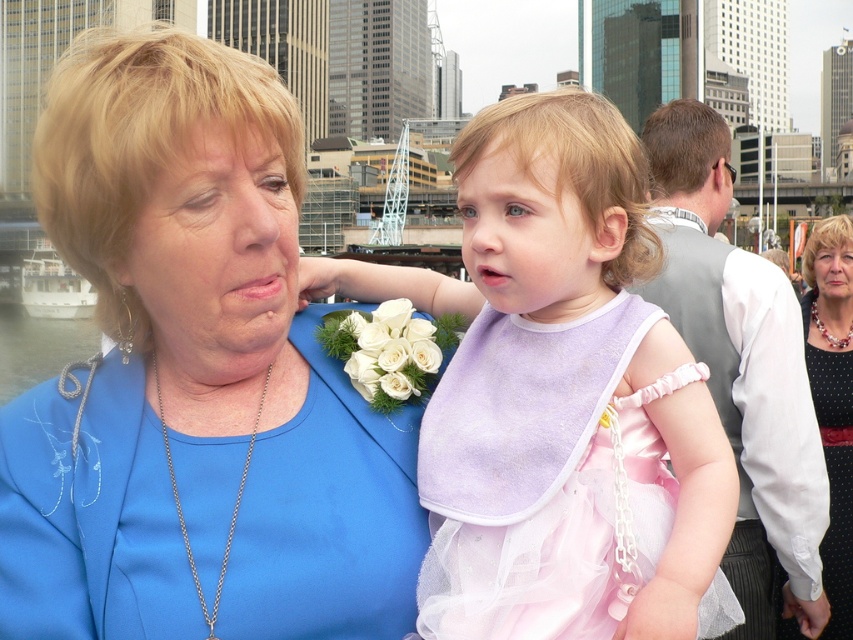
Question: Does pale pink tulle dress at center appear over black dotted dress at center?

Choices:
 (A) no
 (B) yes

Answer: (A)

Question: Which of these objects is positioned closest to the blue satin dress at upper left?

Choices:
 (A) gray fabric vest at right
 (B) pink satin dress at center

Answer: (B)

Question: Which object is farther from the camera taking this photo?

Choices:
 (A) pale pink tulle dress at center
 (B) blue satin dress at upper left
 (C) black dotted dress at center
 (D) gray fabric vest at right

Answer: (C)

Question: Can you confirm if blue satin dress at upper left is thinner than gray fabric vest at right?

Choices:
 (A) yes
 (B) no

Answer: (B)

Question: Which point is farther to the camera?

Choices:
 (A) (747, 429)
 (B) (405, 616)
 (C) (830, 388)
 (D) (587, 324)

Answer: (C)

Question: Can you confirm if pale pink tulle dress at center is smaller than gray fabric vest at right?

Choices:
 (A) no
 (B) yes

Answer: (B)